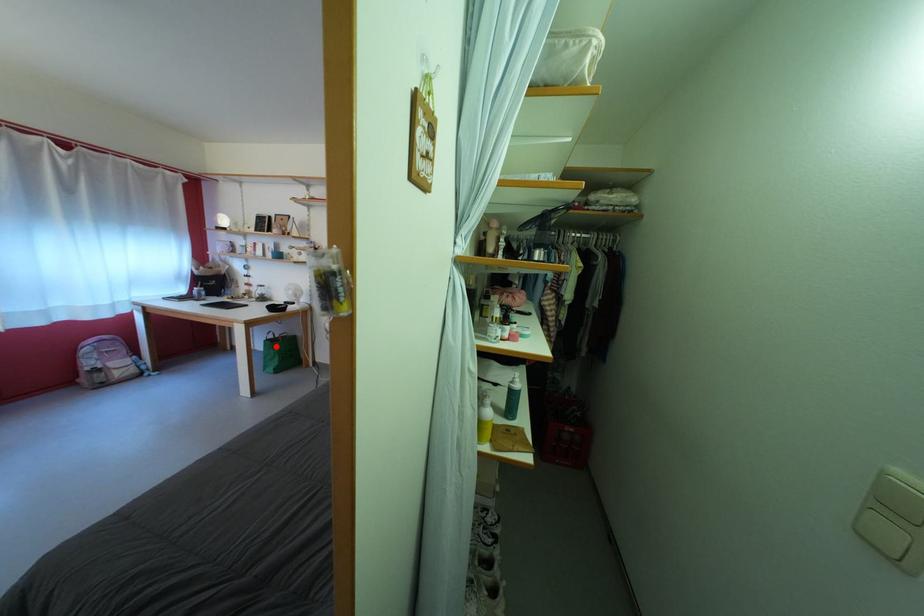
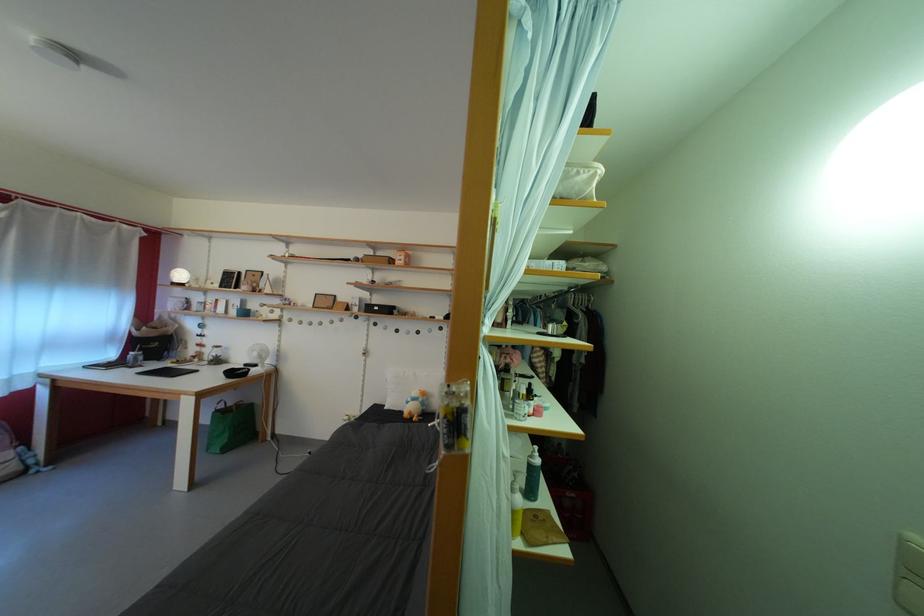
Question: A red point is marked in image1. In image2, is the corresponding 3D point closer to the camera or farther? Reply with the corresponding letter.

Choices:
 (A) The corresponding 3D point is closer.
 (B) The corresponding 3D point is farther.

Answer: (A)